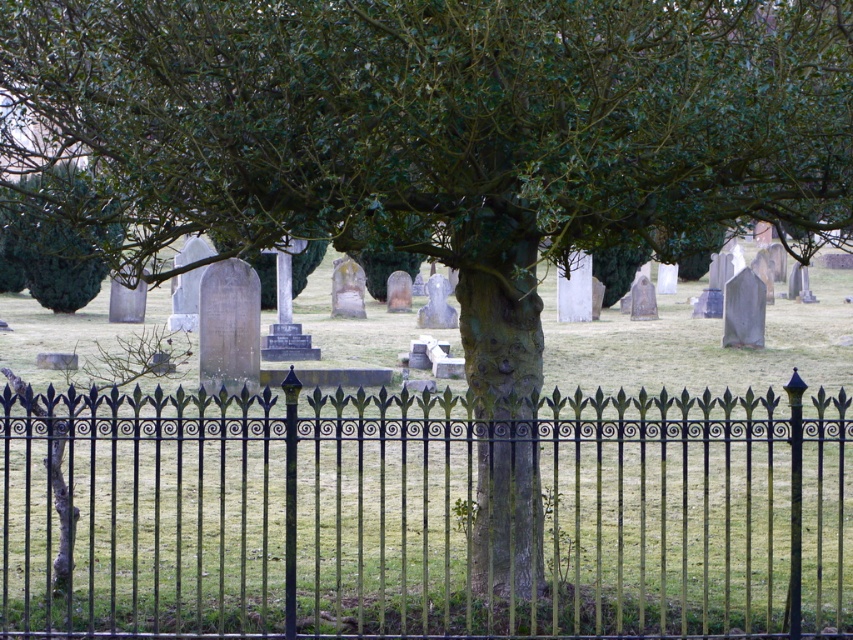
You are a gardener who needs to trim the green leafy tree at upper left. You have a ladder that is 2.5 meters long. Can you reach the tree from the black wrought iron fence at center without moving the ladder?

The distance between the black wrought iron fence at center and the green leafy tree at upper left is 3.02 meters. Since the ladder is only 2.5 meters long, it is not long enough to bridge the gap. Therefore, you cannot reach the tree from the fence without moving the ladder.

You are standing at the entrance of the cemetery and want to take a photo of the black wrought iron fence at center and the green leafy tree at upper left. Which object will appear taller in the photo?

The green leafy tree at upper left will appear taller in the photo because the black wrought iron fence at center has a lesser height compared to it.